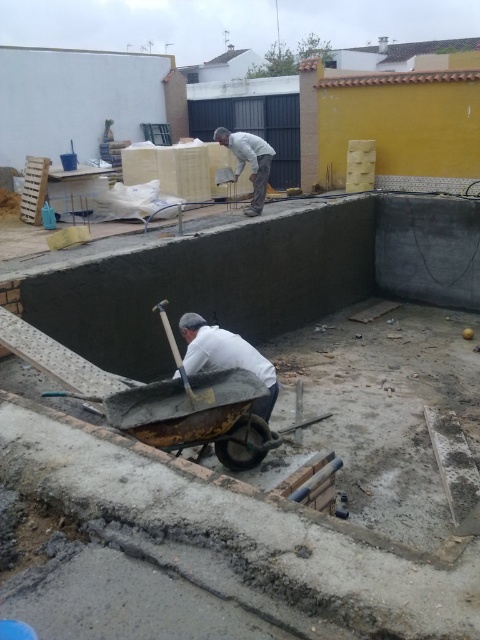
Question: Which point appears farthest from the camera in this image?

Choices:
 (A) (192, 372)
 (B) (158, 308)
 (C) (252, 172)

Answer: (C)

Question: Which of these objects is positioned farthest from the concrete wheelbarrow at center?

Choices:
 (A) white matte shirt at center
 (B) rusty metal cart at center
 (C) white matte shirt at upper center

Answer: (C)

Question: Does concrete wheelbarrow at center come behind white matte shirt at center?

Choices:
 (A) no
 (B) yes

Answer: (A)

Question: Based on their relative distances, which object is farther from the concrete wheelbarrow at center?

Choices:
 (A) rusty metal cart at center
 (B) white matte shirt at upper center

Answer: (B)

Question: Observing the image, what is the correct spatial positioning of rusty metal cart at center in reference to white matte shirt at upper center?

Choices:
 (A) below
 (B) above

Answer: (A)

Question: Is concrete wheelbarrow at center above rusty metal cart at center?

Choices:
 (A) yes
 (B) no

Answer: (A)